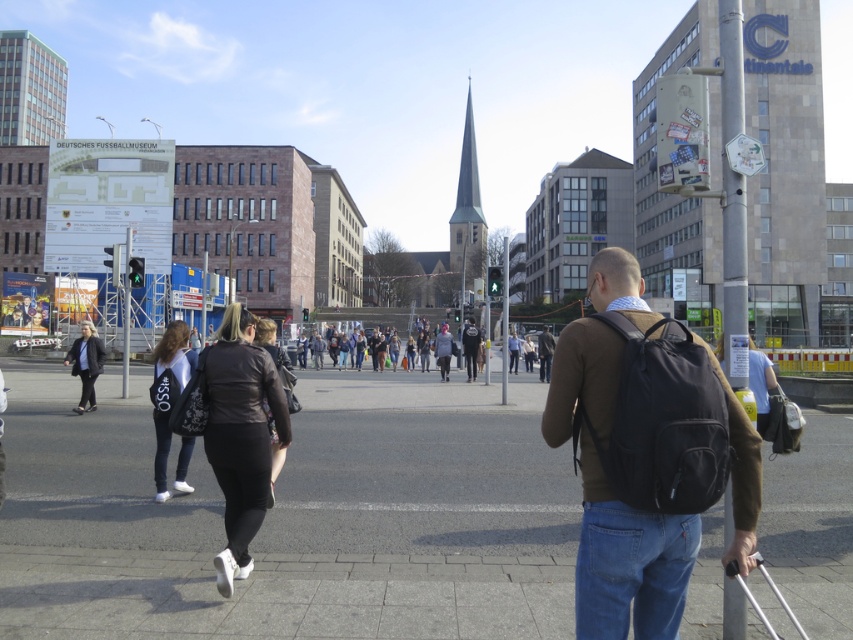
Question: In this image, where is dark gray leather jacket at lower left located relative to dark brown leather jacket at center?

Choices:
 (A) left
 (B) right

Answer: (A)

Question: Estimate the real-world distances between objects in this image. Which object is farther from the dark brown leather jacket at center?

Choices:
 (A) smooth concrete pavement at center
 (B) brown leather jacket at center

Answer: (A)

Question: Among these points, which one is nearest to the camera?

Choices:
 (A) (x=733, y=397)
 (B) (x=543, y=376)
 (C) (x=85, y=372)
 (D) (x=83, y=596)

Answer: (A)

Question: Does matte black backpack at right appear on the right side of brown leather jacket at center?

Choices:
 (A) no
 (B) yes

Answer: (A)

Question: Considering the real-world distances, which object is farthest from the leather jacket at center?

Choices:
 (A) dark brown leather jacket at center
 (B) dark gray leather jacket at lower left
 (C) white leather jacket at lower left
 (D) matte black backpack at right

Answer: (A)

Question: Can you confirm if dark brown leather jacket at center is smaller than brown leather jacket at center?

Choices:
 (A) no
 (B) yes

Answer: (B)